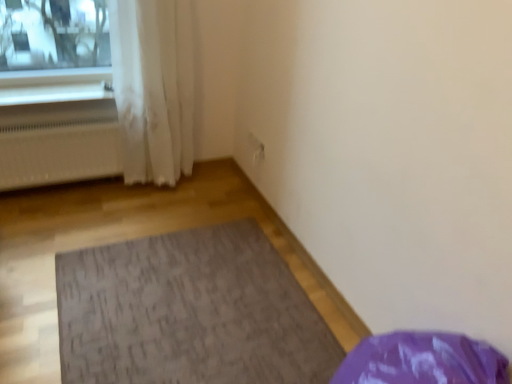
Locate an element on the screen. The width and height of the screenshot is (512, 384). space that is in front of white sheer curtain at left is located at coordinates (137, 210).